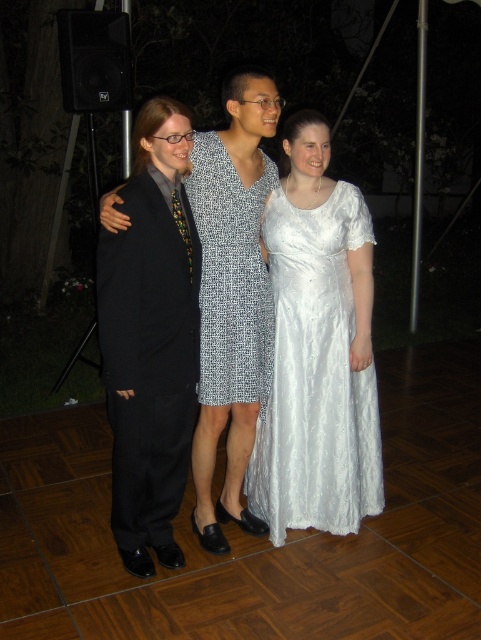
Can you confirm if black matte suit at left is taller than printed fabric dress at center?

Correct, black matte suit at left is much taller as printed fabric dress at center.

Is black matte suit at left wider than printed fabric dress at center?

Indeed, black matte suit at left has a greater width compared to printed fabric dress at center.

Is point (134, 240) positioned after point (204, 253)?

No.

This screenshot has width=481, height=640. I want to click on black matte suit at left, so click(x=151, y=339).

Which is above, white satin dress at center or printed fabric dress at center?

printed fabric dress at center is above.

Can you confirm if white satin dress at center is positioned to the left of printed fabric dress at center?

In fact, white satin dress at center is to the right of printed fabric dress at center.

The width and height of the screenshot is (481, 640). I want to click on white satin dress at center, so click(316, 376).

Who is positioned more to the left, black matte suit at left or white satin dress at center?

black matte suit at left is more to the left.

Does black matte suit at left appear under white satin dress at center?

No.

You are a GUI agent. You are given a task and a screenshot of the screen. Output one action in this format:
    pyautogui.click(x=<x>, y=<y>)
    Task: Click on the black matte suit at left
    The width and height of the screenshot is (481, 640).
    Given the screenshot: What is the action you would take?
    pyautogui.click(x=151, y=339)